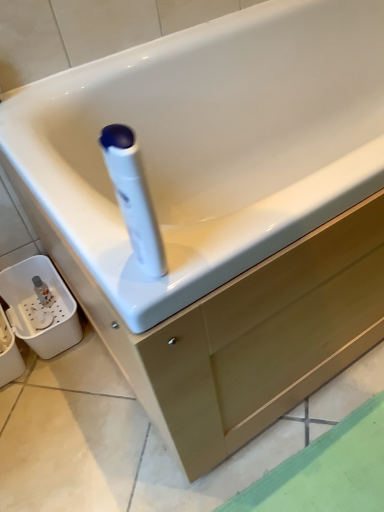
Question: Is point (140, 205) closer or farther from the camera than point (153, 345)?

Choices:
 (A) closer
 (B) farther

Answer: (A)

Question: Considering the relative positions of white glossy cleaning product at center and matte wood drawer at center in the image provided, is white glossy cleaning product at center to the left or to the right of matte wood drawer at center?

Choices:
 (A) left
 (B) right

Answer: (A)

Question: Based on their sizes in the image, would you say white glossy cleaning product at center is bigger or smaller than matte wood drawer at center?

Choices:
 (A) small
 (B) big

Answer: (A)

Question: Considering their positions, is matte wood drawer at center located in front of or behind white glossy cleaning product at center?

Choices:
 (A) behind
 (B) front

Answer: (A)

Question: In terms of height, does matte wood drawer at center look taller or shorter compared to white glossy cleaning product at center?

Choices:
 (A) tall
 (B) short

Answer: (B)

Question: From a real-world perspective, is matte wood drawer at center physically located above or below white glossy cleaning product at center?

Choices:
 (A) above
 (B) below

Answer: (B)

Question: Considering the positions of matte wood drawer at center and white glossy cleaning product at center in the image, is matte wood drawer at center wider or thinner than white glossy cleaning product at center?

Choices:
 (A) wide
 (B) thin

Answer: (A)